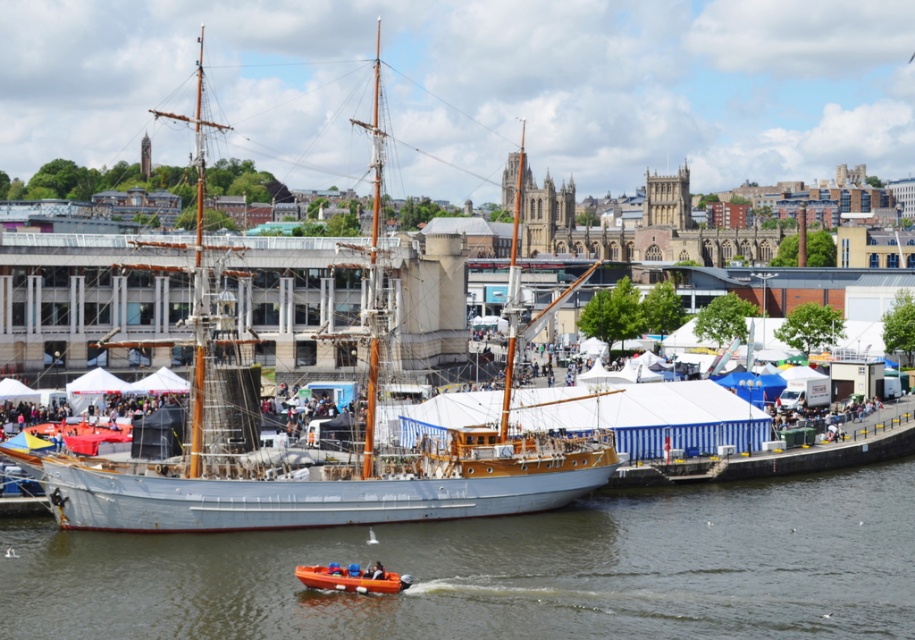
You are organizing a water taxi service and need to determine which vessel can accommodate more passengers. Based on the scene, which one between the brown wooden boat at center and the white wooden ship at center can carry more people?

The white wooden ship at center can carry more people because it occupies more space than the brown wooden boat at center, as stated in the description.

You are a photographer positioned at the origin point of the image coordinate system. You want to capture a photo of the brown wooden boat at center. What are the coordinates where you should aim your camera?

The brown wooden boat at center is located at point coordinates of (504, 570). You should aim your camera at these coordinates to capture the boat.

You are standing on the pier and want to board the brown wooden boat at center. However, you notice the white wooden ship at center is in the way. Can you walk around the ship to reach the boat?

The brown wooden boat at center is positioned under the white wooden ship at center, meaning the ship is directly above the boat. Since the ship is docked, you cannot walk around it to reach the boat.